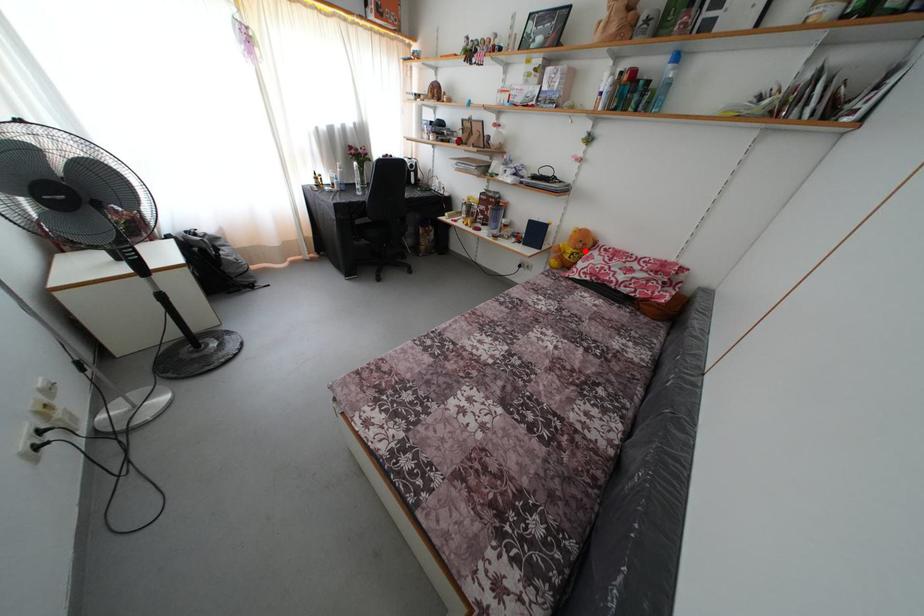
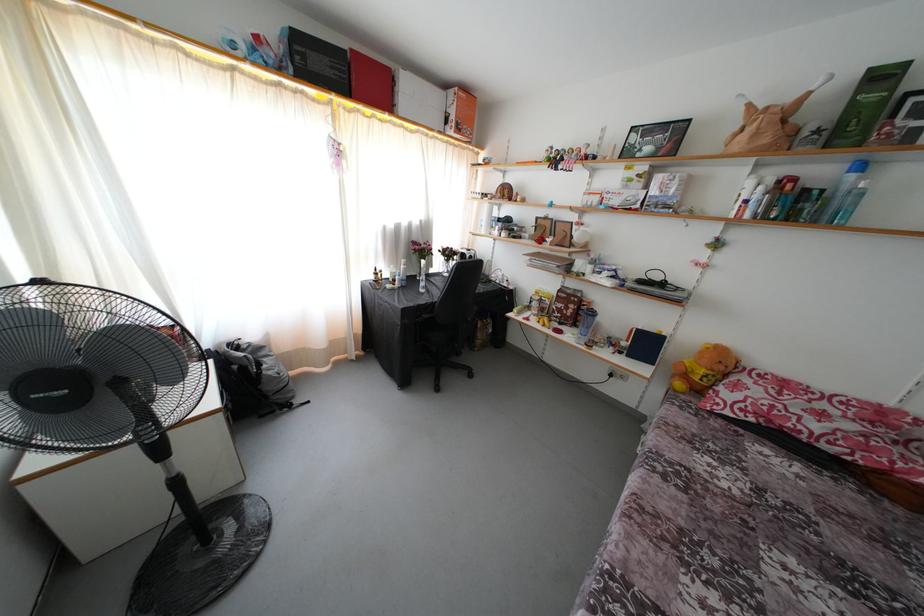
Where in the second image is the point corresponding to the highlighted location from the first image?

(726, 373)